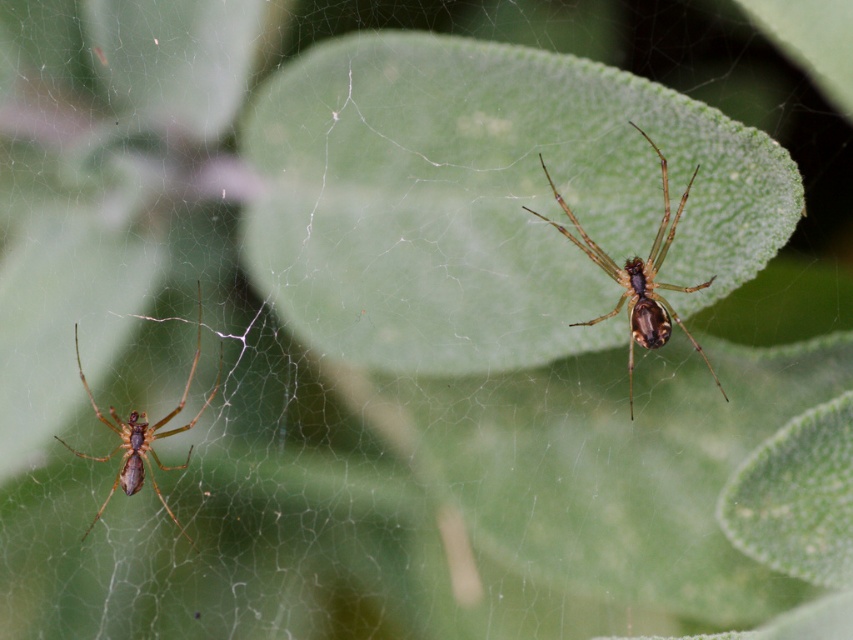
You are a GUI agent. You are given a task and a screenshot of the screen. Output one action in this format:
    pyautogui.click(x=<x>, y=<y>)
    Task: Click on the brown fuzzy spider at upper right
    This screenshot has width=853, height=640.
    Given the screenshot: What is the action you would take?
    pyautogui.click(x=637, y=276)

Who is taller, brown fuzzy spider at upper right or brown fuzzy spider at left?

With more height is brown fuzzy spider at upper right.

Between point (645, 316) and point (79, 371), which one is positioned behind?

The point (79, 371) is behind.

This screenshot has height=640, width=853. Identify the location of brown fuzzy spider at upper right. (637, 276).